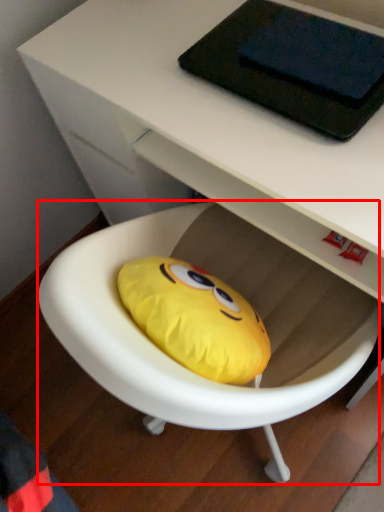
Question: In this image, where is bean bag chair (annotated by the red box) located relative to tablet computer?

Choices:
 (A) left
 (B) right

Answer: (A)